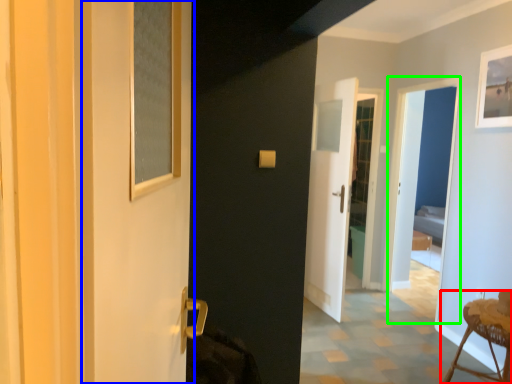
Question: Which object is positioned farthest from furniture (highlighted by a red box)? Select from screen door (highlighted by a blue box) and screen door (highlighted by a green box).

Choices:
 (A) screen door
 (B) screen door

Answer: (A)